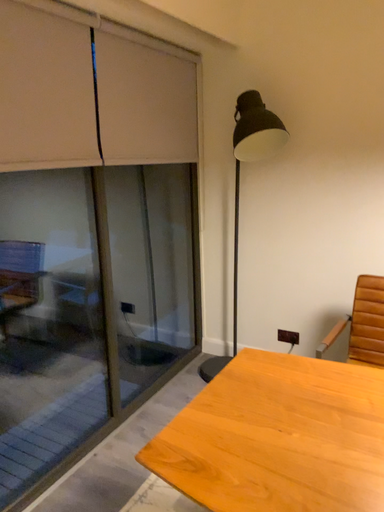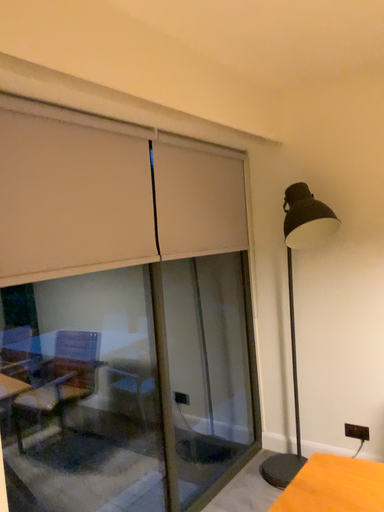
Question: Which way did the camera rotate in the video?

Choices:
 (A) rotated right
 (B) rotated left

Answer: (B)